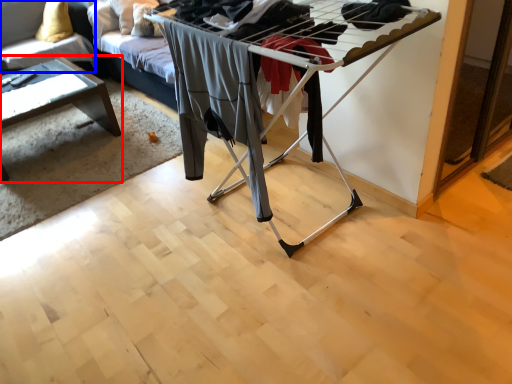
Question: Which point is closer to the camera, table (highlighted by a red box) or couch (highlighted by a blue box)?

Choices:
 (A) table
 (B) couch

Answer: (A)